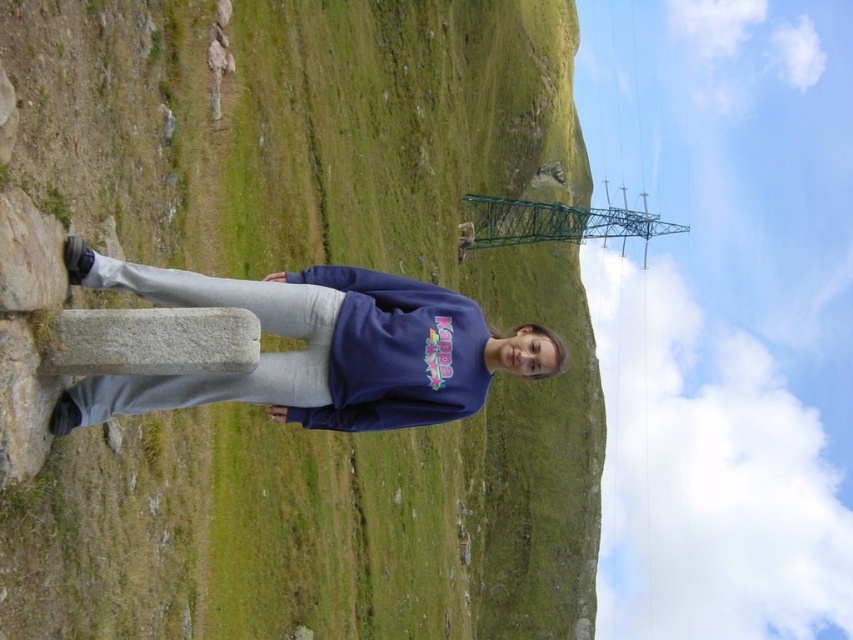
You are a hiker who wants to take a photo of the green grassy hillside at center and the matte blue sweatshirt at center. Which object should you focus on first if you want to capture both in one frame without moving the camera?

The green grassy hillside at center is above the matte blue sweatshirt at center, so you should focus on the matte blue sweatshirt at center first since it is closer to the camera and then adjust the focus to include the hillside in the background.

You are standing at the point marked by the coordinates point (297, 268) in the image. What is the immediate terrain you are standing on?

The point (297, 268) corresponds to the green grassy hillside at center, so you are standing on grass.

You are standing on the green grassy hillside at center and want to move to the matte blue sweatshirt at center. Is the sweatshirt in front of or behind you?

The matte blue sweatshirt at center is behind you because the green grassy hillside at center is closer to the viewer, meaning the sweatshirt is further away.